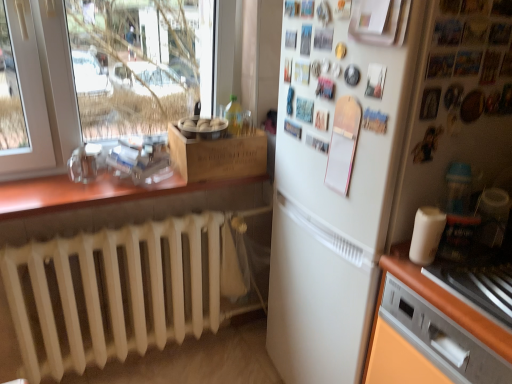
Question: Is white matte cup at right positioned behind white matte radiator at lower left?

Choices:
 (A) yes
 (B) no

Answer: (B)

Question: Considering the relative positions of white matte cup at right and white matte radiator at lower left in the image provided, is white matte cup at right to the right of white matte radiator at lower left from the viewer's perspective?

Choices:
 (A) yes
 (B) no

Answer: (A)

Question: Is white matte radiator at lower left located within white matte cup at right?

Choices:
 (A) yes
 (B) no

Answer: (B)

Question: Is white matte cup at right bigger than white matte radiator at lower left?

Choices:
 (A) yes
 (B) no

Answer: (B)

Question: From the image's perspective, is white matte cup at right below white matte radiator at lower left?

Choices:
 (A) no
 (B) yes

Answer: (A)

Question: Is white matte cup at right facing away from white matte radiator at lower left?

Choices:
 (A) no
 (B) yes

Answer: (A)

Question: From a real-world perspective, is white matte radiator at lower left on brown wood countertop at left?

Choices:
 (A) yes
 (B) no

Answer: (B)

Question: Does white matte radiator at lower left appear on the left side of brown wood countertop at left?

Choices:
 (A) yes
 (B) no

Answer: (B)

Question: Can you confirm if white matte radiator at lower left is smaller than brown wood countertop at left?

Choices:
 (A) no
 (B) yes

Answer: (A)

Question: Does white matte radiator at lower left have a greater height compared to brown wood countertop at left?

Choices:
 (A) yes
 (B) no

Answer: (A)

Question: Is white matte radiator at lower left facing away from brown wood countertop at left?

Choices:
 (A) yes
 (B) no

Answer: (B)

Question: Is white matte radiator at lower left not inside brown wood countertop at left?

Choices:
 (A) yes
 (B) no

Answer: (A)

Question: Can you confirm if metallic silver dishwasher at lower right is taller than white matte cup at right?

Choices:
 (A) yes
 (B) no

Answer: (A)